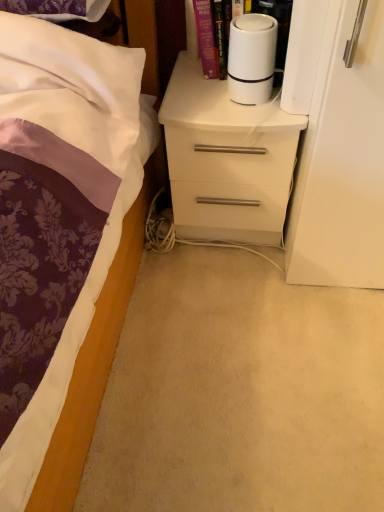
Question: Is white matte cylindrical object at upper center looking in the opposite direction of white matte cylindrical device at upper right?

Choices:
 (A) yes
 (B) no

Answer: (A)

Question: Is white matte cylindrical object at upper center to the left of white matte cylindrical device at upper right from the viewer's perspective?

Choices:
 (A) yes
 (B) no

Answer: (B)

Question: From a real-world perspective, is white matte cylindrical object at upper center located beneath white matte cylindrical device at upper right?

Choices:
 (A) yes
 (B) no

Answer: (A)

Question: Does white matte cylindrical object at upper center come behind white matte cylindrical device at upper right?

Choices:
 (A) yes
 (B) no

Answer: (B)

Question: Is white matte cylindrical object at upper center not near white matte cylindrical device at upper right?

Choices:
 (A) yes
 (B) no

Answer: (B)

Question: Does white matte cylindrical object at upper center have a lesser height compared to white matte cylindrical device at upper right?

Choices:
 (A) no
 (B) yes

Answer: (B)

Question: Is white matte cylindrical object at upper center bigger than white glossy chest of drawers at center?

Choices:
 (A) yes
 (B) no

Answer: (B)

Question: Does white matte cylindrical object at upper center have a smaller size compared to white glossy chest of drawers at center?

Choices:
 (A) yes
 (B) no

Answer: (A)

Question: Could you tell me if white matte cylindrical object at upper center is turned towards white glossy chest of drawers at center?

Choices:
 (A) no
 (B) yes

Answer: (A)

Question: Is the depth of white matte cylindrical object at upper center greater than that of white glossy chest of drawers at center?

Choices:
 (A) no
 (B) yes

Answer: (A)

Question: Considering the relative sizes of white matte cylindrical object at upper center and white glossy chest of drawers at center in the image provided, is white matte cylindrical object at upper center wider than white glossy chest of drawers at center?

Choices:
 (A) yes
 (B) no

Answer: (B)

Question: From a real-world perspective, is white matte cylindrical object at upper center below white glossy chest of drawers at center?

Choices:
 (A) yes
 (B) no

Answer: (B)

Question: Is white glossy chest of drawers at center thinner than white matte cylindrical object at upper center?

Choices:
 (A) no
 (B) yes

Answer: (A)